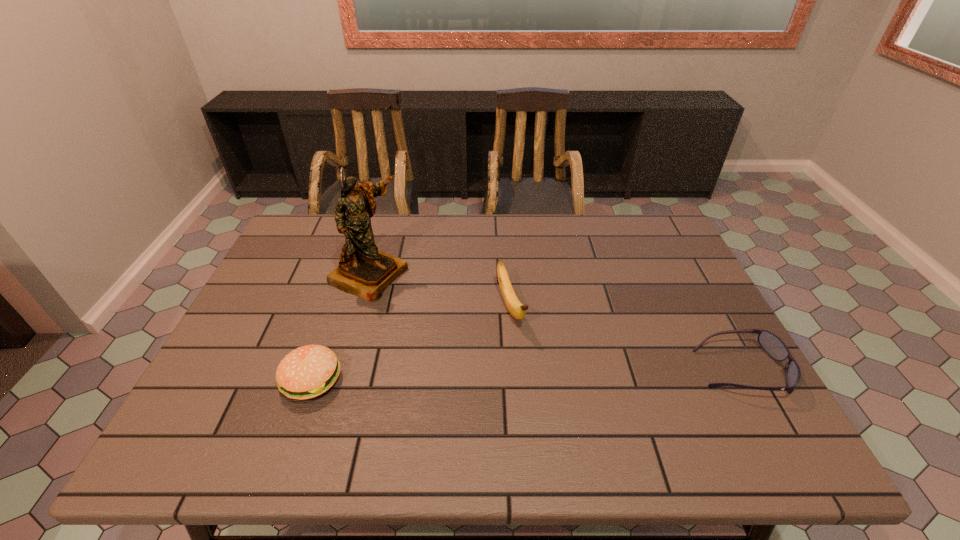
The height and width of the screenshot is (540, 960). What are the coordinates of `vacant area situated 0.300m on the front-facing side of the figurine` in the screenshot? It's located at (490, 329).

This screenshot has height=540, width=960. In order to click on vacant area situated 0.090m on the front-facing side of the figurine in this screenshot , I will do `click(424, 300)`.

Where is `object located in the far edge section of the desktop`? This screenshot has height=540, width=960. object located in the far edge section of the desktop is located at coordinates (364, 271).

This screenshot has width=960, height=540. Find the location of `patty located in the near edge section of the desktop`. patty located in the near edge section of the desktop is located at coordinates (308, 371).

Find the location of `sunglasses positioned at the near edge`. sunglasses positioned at the near edge is located at coordinates (771, 344).

Identify the location of object that is positioned at the right edge. (771, 344).

Where is `object that is at the near right corner`? Image resolution: width=960 pixels, height=540 pixels. object that is at the near right corner is located at coordinates (771, 344).

Locate an element on the screen. vacant space at the far edge of the desktop is located at coordinates (434, 227).

The height and width of the screenshot is (540, 960). I want to click on free space at the near edge, so click(x=651, y=382).

In the image, there is a desktop. Where is `vacant space at the left edge`? This screenshot has height=540, width=960. vacant space at the left edge is located at coordinates (287, 301).